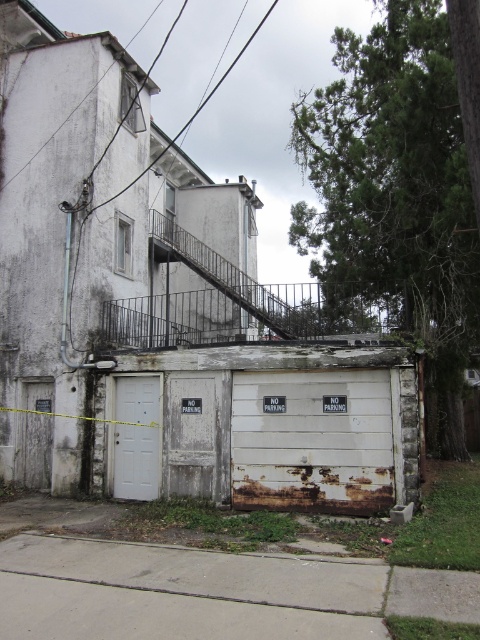
Question: In this image, where is rusty white garage door at lower center located relative to white matte door at lower left?

Choices:
 (A) left
 (B) right

Answer: (B)

Question: Can you confirm if rusty white garage door at lower center is wider than gray concrete sidewalk at lower center?

Choices:
 (A) no
 (B) yes

Answer: (B)

Question: Estimate the real-world distances between objects in this image. Which object is farther from the gray concrete sidewalk at lower center?

Choices:
 (A) white matte door at lower left
 (B) rusty wood garage door at center

Answer: (A)

Question: Which of the following is the closest to the observer?

Choices:
 (A) (148, 388)
 (B) (289, 636)
 (C) (266, 424)

Answer: (B)

Question: Which object is positioned farthest from the rusty wood garage door at center?

Choices:
 (A) white matte door at lower left
 (B) gray concrete sidewalk at lower center
 (C) rusty white garage door at lower center

Answer: (B)

Question: Can you confirm if gray concrete sidewalk at lower center is positioned below rusty wood garage door at center?

Choices:
 (A) no
 (B) yes

Answer: (B)